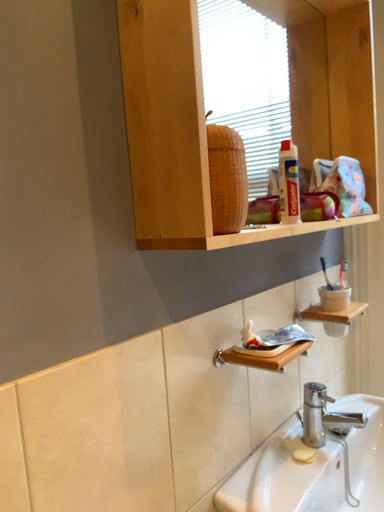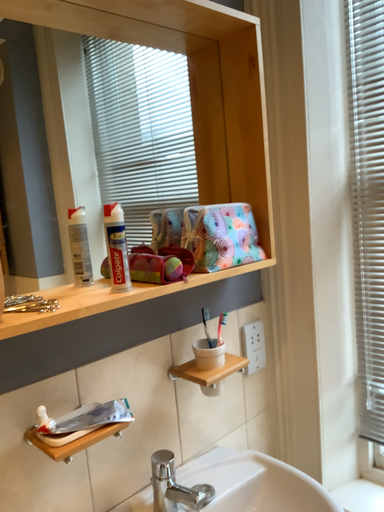
Question: Which way did the camera rotate in the video?

Choices:
 (A) rotated right
 (B) rotated left

Answer: (B)